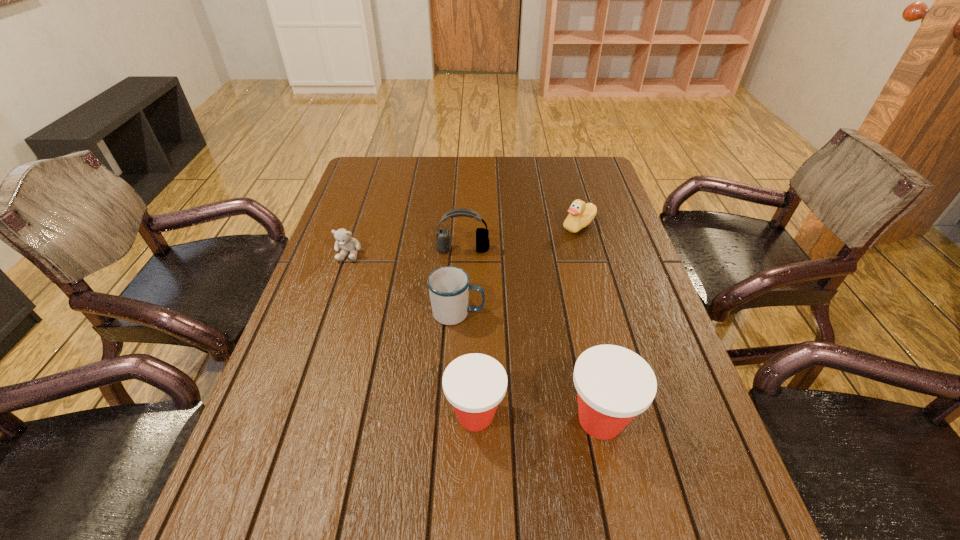
Please show where to add a Dixie cup on the left while keeping spacing even. Please provide its 2D coordinates. Your answer should be formatted as a tuple, i.e. [(x, y)], where the tuple contains the x and y coordinates of a point satisfying the conditions above.

[(352, 410)]